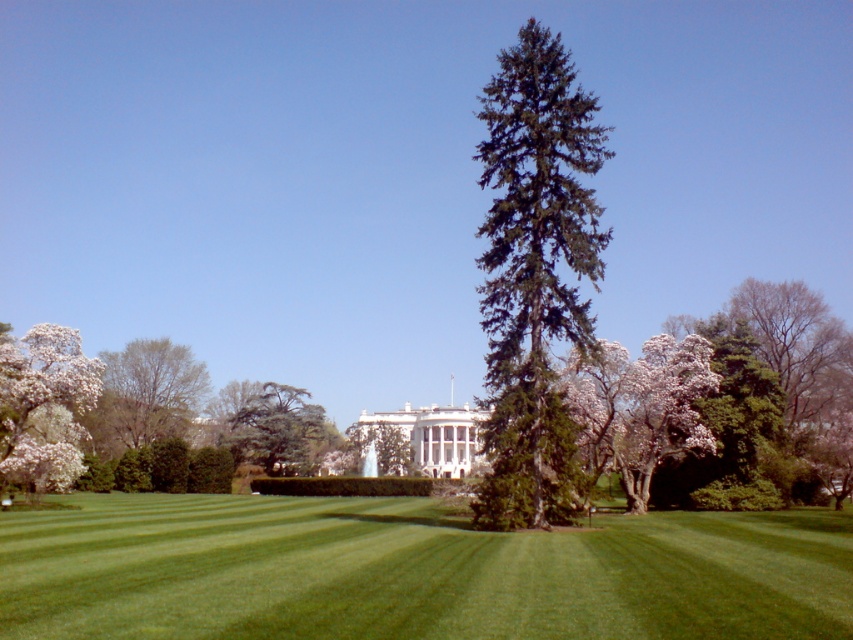
Identify the location of white textured tree at right. (660, 410).

Can you confirm if white textured tree at right is wider than green leafy tree at left?

In fact, white textured tree at right might be narrower than green leafy tree at left.

Image resolution: width=853 pixels, height=640 pixels. Identify the location of white textured tree at right. (660, 410).

Image resolution: width=853 pixels, height=640 pixels. What are the coordinates of `white textured tree at right` in the screenshot? It's located at (660, 410).

Does green leafy tree at left appear on the right side of green textured tree at center?

Incorrect, green leafy tree at left is not on the right side of green textured tree at center.

Is green leafy tree at left below green textured tree at center?

Actually, green leafy tree at left is above green textured tree at center.

Where is `green leafy tree at left`? The width and height of the screenshot is (853, 640). green leafy tree at left is located at coordinates (148, 394).

You are a GUI agent. You are given a task and a screenshot of the screen. Output one action in this format:
    pyautogui.click(x=<x>, y=<y>)
    Task: Click on the green leafy tree at left
    
    Given the screenshot: What is the action you would take?
    pyautogui.click(x=148, y=394)

Is point (784, 621) positioned after point (183, 403)?

No, it is in front of (183, 403).

Image resolution: width=853 pixels, height=640 pixels. Describe the element at coordinates (413, 572) in the screenshot. I see `green grassy at center` at that location.

Image resolution: width=853 pixels, height=640 pixels. I want to click on green grassy at center, so click(x=413, y=572).